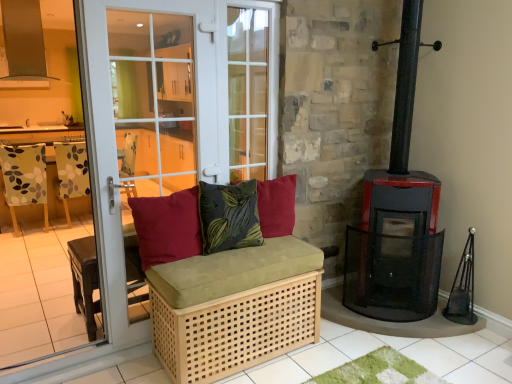
Question: Relative to black metal wood burning stove at right, is natural wood woven basket at lower center in front or behind?

Choices:
 (A) front
 (B) behind

Answer: (A)

Question: In terms of height, does natural wood woven basket at lower center look taller or shorter compared to black metal wood burning stove at right?

Choices:
 (A) tall
 (B) short

Answer: (B)

Question: Considering the real-world distances, which object is closest to the velvet green pillow at center, the 2th pillow positioned from the right?

Choices:
 (A) patterned fabric armchair at left
 (B) white glass door at left
 (C) black metal wood burning stove at right
 (D) velvet red cushion at center, the third pillow from the left
 (E) matte red cushion at center, marked as the 1th pillow in a left-to-right arrangement

Answer: (E)

Question: Which of these objects is positioned closest to the velvet green pillow at center, the 2th pillow positioned from the right?

Choices:
 (A) velvet red cushion at center, which appears as the first pillow when viewed from the right
 (B) floral fabric chair at left
 (C) white glass door at left
 (D) black metal wood burning stove at right
 (E) natural wood woven basket at lower center

Answer: (A)